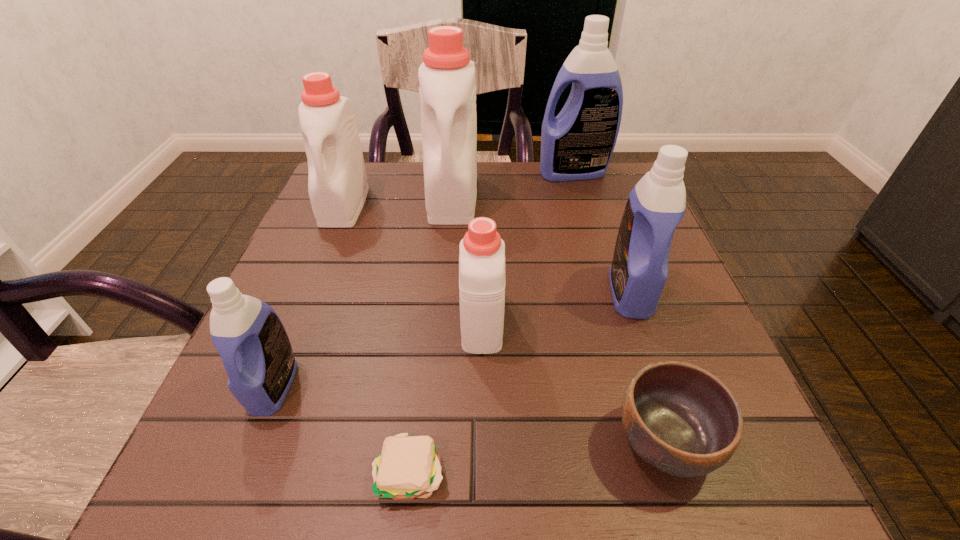
The width and height of the screenshot is (960, 540). I want to click on the biggest white detergent, so click(x=447, y=90).

Where is `the farthest blue detergent`? The height and width of the screenshot is (540, 960). the farthest blue detergent is located at coordinates (577, 144).

The height and width of the screenshot is (540, 960). Identify the location of the second smallest white detergent. (337, 180).

In order to click on the second nearest blue detergent in this screenshot , I will do `click(656, 205)`.

Locate an element on the screen. Image resolution: width=960 pixels, height=540 pixels. the smallest white detergent is located at coordinates (482, 251).

Locate an element on the screen. the leftmost blue detergent is located at coordinates (249, 336).

Find the location of `the nearest blue detergent`. the nearest blue detergent is located at coordinates (249, 336).

Locate an element on the screen. Image resolution: width=960 pixels, height=540 pixels. bowl is located at coordinates pyautogui.click(x=680, y=419).

Locate an element on the screen. This screenshot has width=960, height=540. patty is located at coordinates (408, 467).

The width and height of the screenshot is (960, 540). Identify the location of free space located 0.390m on the handle side of the biggest white detergent. (439, 369).